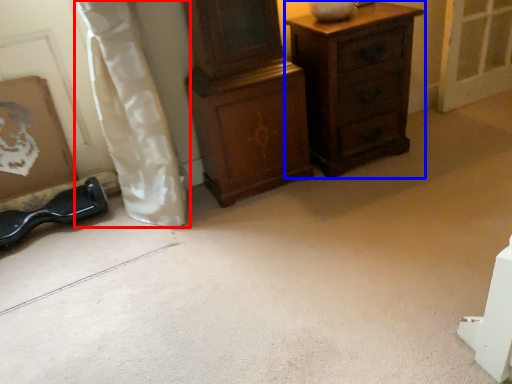
Question: Which point is closer to the camera, curtain (highlighted by a red box) or chest of drawers (highlighted by a blue box)?

Choices:
 (A) curtain
 (B) chest of drawers

Answer: (A)